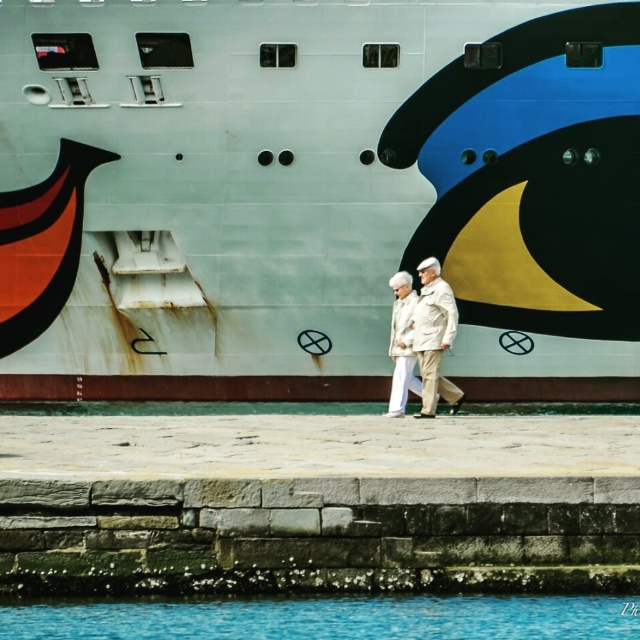
This screenshot has height=640, width=640. I want to click on blue liquid water at lower center, so click(326, 618).

Does point (20, 602) come farther from viewer compared to point (445, 346)?

No.

Locate an element on the screen. The height and width of the screenshot is (640, 640). blue liquid water at lower center is located at coordinates (326, 618).

Is white matte ship at center positioned at the back of blue liquid water at lower center?

Yes.

Is point (308, 88) farther from camera compared to point (504, 604)?

Yes, it is.

Find the location of `white matte ship at center`. white matte ship at center is located at coordinates (316, 195).

Between point (156, 96) and point (420, 296), which one is positioned behind?

Point (420, 296)

Does white matte ship at center have a lesser width compared to beige fabric coat at center?

Yes.

Is point (212, 292) less distant than point (451, 307)?

No, it is not.

This screenshot has width=640, height=640. Find the location of `white matte ship at center`. white matte ship at center is located at coordinates (316, 195).